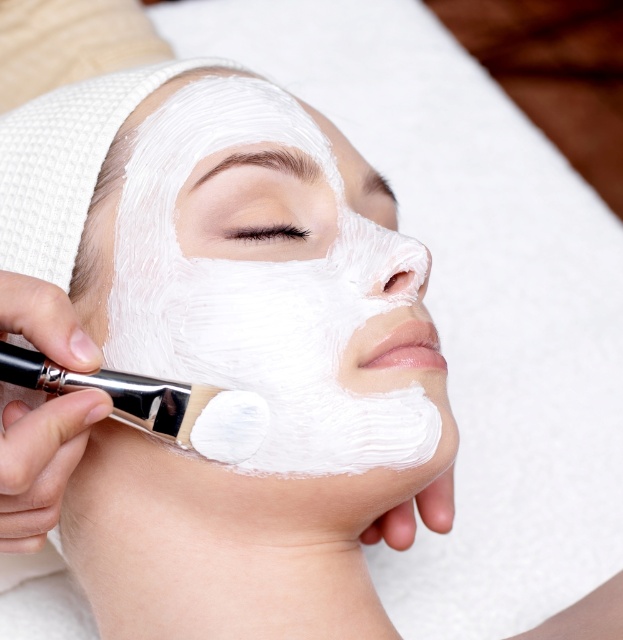
Question: Among these objects, which one is nearest to the camera?

Choices:
 (A) white matte eye at upper center
 (B) white matte facial mask at center
 (C) white matte eyelashes at center

Answer: (B)

Question: Which point is closer to the camera taking this photo?

Choices:
 (A) (245, 236)
 (B) (224, 380)
 (C) (386, 193)
 (D) (204, 400)

Answer: (D)

Question: Is white matte brush at center positioned before white matte eyelashes at center?

Choices:
 (A) no
 (B) yes

Answer: (B)

Question: Does white matte eyelashes at center lie in front of white matte eye at upper center?

Choices:
 (A) yes
 (B) no

Answer: (A)

Question: Which point is farther to the camera?

Choices:
 (A) (371, 186)
 (B) (227, 413)
 (C) (240, 227)
 (D) (257, 211)

Answer: (A)

Question: Is white matte brush at center above white matte eye at upper center?

Choices:
 (A) yes
 (B) no

Answer: (B)